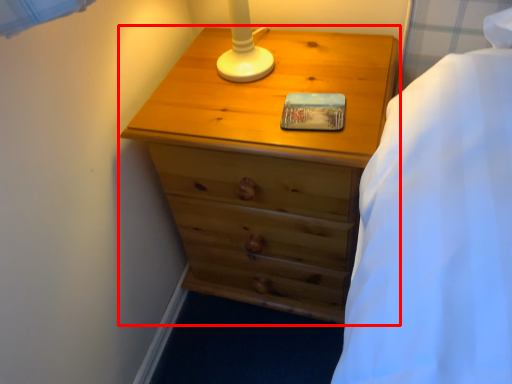
Question: From the image's perspective, where is chest of drawers (annotated by the red box) located relative to pad?

Choices:
 (A) below
 (B) above

Answer: (A)